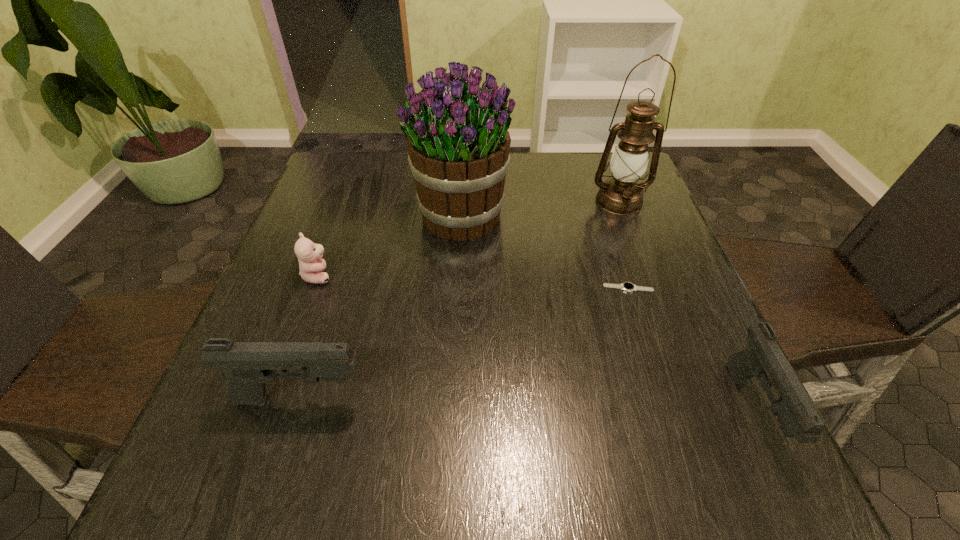
Please point a location where one more pistol can be added evenly. Please provide its 2D coordinates. Your answer should be formatted as a tuple, i.e. [(x, y)], where the tuple contains the x and y coordinates of a point satisfying the conditions above.

[(525, 404)]